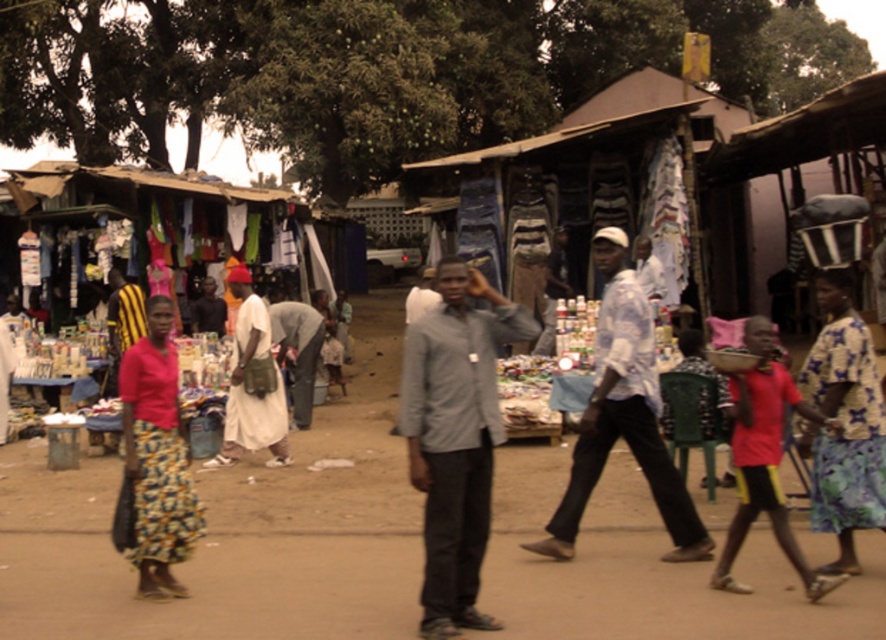
You are a customer at the market and want to buy a gray cotton shirt. The vendor tells you that the gray cotton shirt is located at point (455, 436). Where should you look to find it?

The gray cotton shirt at center is located at point (455, 436), so you should look there to find it.

You are a customer at the market and want to buy both the gray cotton shirt at center and the floral print skirt at left. If you stand facing the stalls, which item is positioned higher up?

The gray cotton shirt at center is taller than the floral print skirt at left, so the gray cotton shirt at center is positioned higher up.

You are standing in the middle of the market and want to walk towards both the point at coordinates (x=418, y=472) and the point at (x=560, y=552). Which point should you head towards first if you want to reach the closer one first?

You should head towards point (x=418, y=472) first because it is closer to you than point (x=560, y=552).